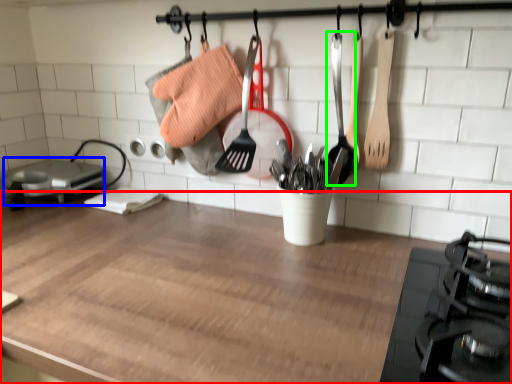
Question: Estimate the real-world distances between objects in this image. Which object is farther from countertop (highlighted by a red box), appliance (highlighted by a blue box) or utensil (highlighted by a green box)?

Choices:
 (A) appliance
 (B) utensil

Answer: (A)